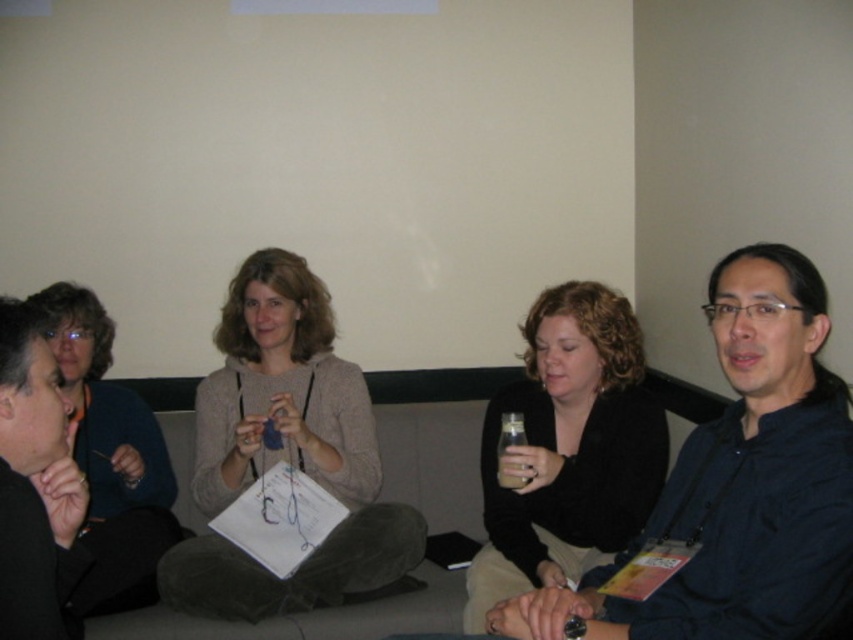
Does matte black shirt at center appear on the right side of black matte jacket at left?

Yes, matte black shirt at center is to the right of black matte jacket at left.

Is point (764, 452) positioned after point (28, 608)?

Yes, point (764, 452) is behind point (28, 608).

Is point (763, 348) in front of point (16, 532)?

No, (763, 348) is further to viewer.

The width and height of the screenshot is (853, 640). In order to click on matte black shirt at center in this screenshot , I will do coord(735,488).

Who is more distant from viewer, (114,483) or (15,348)?

Positioned behind is point (114,483).

Who is positioned more to the right, matte blue sweater at left or black matte jacket at left?

black matte jacket at left

The height and width of the screenshot is (640, 853). In order to click on matte blue sweater at left in this screenshot , I will do `click(109, 458)`.

Who is more distant from viewer, [579,465] or [73,536]?

Point [579,465]

Can you confirm if matte black sweater at center is bigger than black matte jacket at left?

Correct, matte black sweater at center is larger in size than black matte jacket at left.

Describe the element at coordinates (567, 449) in the screenshot. This screenshot has height=640, width=853. I see `matte black sweater at center` at that location.

Locate an element on the screen. The height and width of the screenshot is (640, 853). matte black sweater at center is located at coordinates (567, 449).